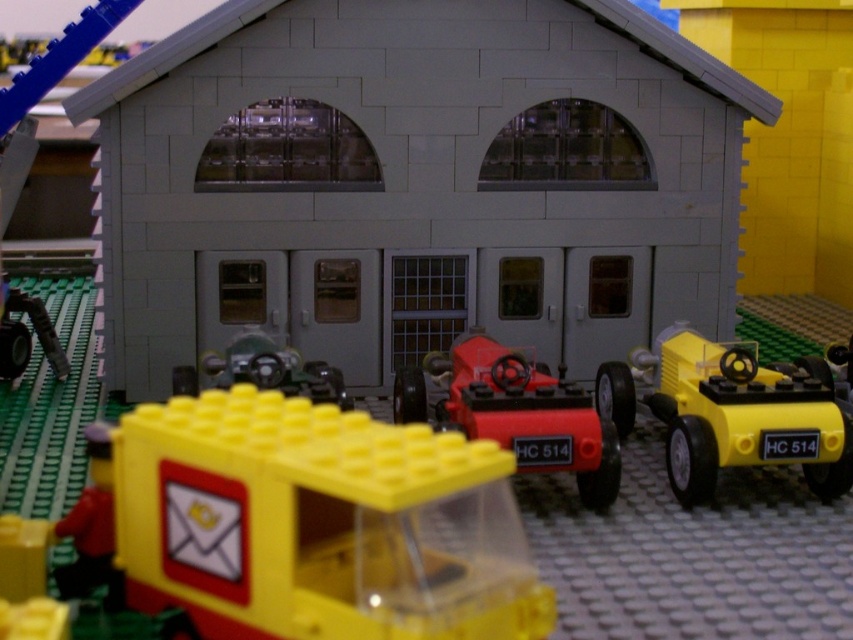
You are standing in front of a LEGO diorama and looking at two points in the scene. The first point is at coordinate point (222, 632) and the second point is at coordinate point (518, 358). Which point is closer to you?

Point (222, 632) is closer to the viewer than point (518, 358).

Based on the photo, you are a LEGO enthusiast examining the diorama. You notice two cars, the yellow plastic car at right and the shiny red car at center. Which car is placed above the other?

The yellow plastic car at right is positioned over the shiny red car at center.